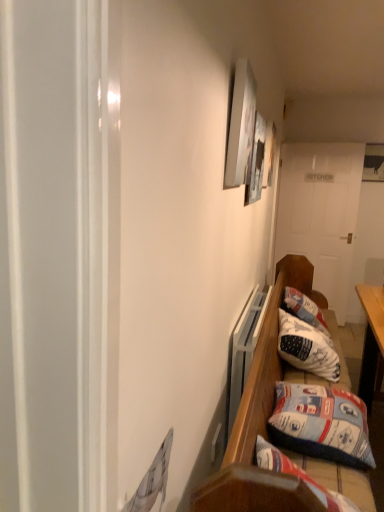
Find the location of a particular element. wooden bench at lower right is located at coordinates (265, 415).

Describe the element at coordinates (256, 162) in the screenshot. The height and width of the screenshot is (512, 384). I see `metallic silver picture frame at upper center, which is the second picture frame from front to back` at that location.

You are a GUI agent. You are given a task and a screenshot of the screen. Output one action in this format:
    pyautogui.click(x=<x>, y=<y>)
    Task: Click on the blue fabric pillow at lower right, positioned as the 2th pillow in back-to-front order
    
    Given the screenshot: What is the action you would take?
    pyautogui.click(x=321, y=424)

Considering the points (338, 484) and (309, 420), which point is behind, point (338, 484) or point (309, 420)?

The point (309, 420) is farther.

Which object is more forward, wooden bench at lower right or blue fabric pillow at lower right, which ranks as the first pillow in front-to-back order?

wooden bench at lower right is closer to the camera.

Can you confirm if wooden bench at lower right is wider than blue fabric pillow at lower right, positioned as the 2th pillow in back-to-front order?

Yes.

Considering the sizes of objects wooden bench at lower right and blue fabric pillow at lower right, which ranks as the first pillow in front-to-back order, in the image provided, who is taller, wooden bench at lower right or blue fabric pillow at lower right, which ranks as the first pillow in front-to-back order,?

wooden bench at lower right is taller.

Would you say blue fabric pillow at lower right, which ranks as the first pillow in front-to-back order, is to the left or to the right of matte white picture frame at upper center, placed as the 2th picture frame when sorted from right to left, in the picture?

Clearly, blue fabric pillow at lower right, which ranks as the first pillow in front-to-back order, is on the right of matte white picture frame at upper center, placed as the 2th picture frame when sorted from right to left, in the image.

How much distance is there between blue fabric pillow at lower right, which ranks as the first pillow in front-to-back order, and matte white picture frame at upper center, which is the first picture frame in front-to-back order?

blue fabric pillow at lower right, which ranks as the first pillow in front-to-back order, and matte white picture frame at upper center, which is the first picture frame in front-to-back order, are 1.06 meters apart.

From the image's perspective, which one is positioned higher, blue fabric pillow at lower right, positioned as the 2th pillow in back-to-front order, or matte white picture frame at upper center, which is counted as the second picture frame, starting from the back?

matte white picture frame at upper center, which is counted as the second picture frame, starting from the back, appears higher in the image.

Is blue fabric pillow at lower right, positioned as the 2th pillow in back-to-front order, not within matte white picture frame at upper center, which is the 1th picture frame in left-to-right order?

blue fabric pillow at lower right, positioned as the 2th pillow in back-to-front order, lies outside matte white picture frame at upper center, which is the 1th picture frame in left-to-right order,'s area.

Is metallic silver picture frame at upper center, which is the second picture frame from front to back, positioned beyond the bounds of white wooden door at center?

Yes.

From the picture: From the image's perspective, which one is positioned higher, metallic silver picture frame at upper center, arranged as the first picture frame when viewed from the back, or white wooden door at center?

metallic silver picture frame at upper center, arranged as the first picture frame when viewed from the back, from the image's perspective.

Which is less distant, (261, 123) or (334, 231)?

The point (261, 123) is closer.

Is metallic silver picture frame at upper center, the 2th picture frame when ordered from left to right, directly adjacent to white wooden door at center?

No, metallic silver picture frame at upper center, the 2th picture frame when ordered from left to right, is not touching white wooden door at center.

In the scene shown: Is there a large distance between matte white picture frame at upper center, which is the 1th picture frame in left-to-right order, and white wooden door at center?

Yes, matte white picture frame at upper center, which is the 1th picture frame in left-to-right order, and white wooden door at center are located far from each other.

How different are the orientations of matte white picture frame at upper center, which is the first picture frame in front-to-back order, and white wooden door at center in degrees?

matte white picture frame at upper center, which is the first picture frame in front-to-back order, and white wooden door at center are facing 102 degrees away from each other.

Is matte white picture frame at upper center, placed as the 2th picture frame when sorted from right to left, facing away from white wooden door at center?

No.

Considering the relative sizes of matte white picture frame at upper center, which is counted as the second picture frame, starting from the back, and white wooden door at center in the image provided, is matte white picture frame at upper center, which is counted as the second picture frame, starting from the back, wider than white wooden door at center?

In fact, matte white picture frame at upper center, which is counted as the second picture frame, starting from the back, might be narrower than white wooden door at center.

Which is nearer, (x=367, y=460) or (x=315, y=276)?

Point (x=367, y=460).

From a real-world perspective, which object rests below the other?

blue fabric pillow at lower right, which ranks as the first pillow in front-to-back order, is physically lower.

Locate an element on the screen. door that appears above the blue fabric pillow at lower right, which ranks as the first pillow in front-to-back order (from the image's perspective) is located at coordinates (321, 213).

Which of these two, white fabric pillow at lower right, positioned as the first pillow in back-to-front order, or white wooden door at center, is wider?

With larger width is white fabric pillow at lower right, positioned as the first pillow in back-to-front order.

Consider the image. From a real-world perspective, is white fabric pillow at lower right, positioned as the first pillow in back-to-front order, physically above white wooden door at center?

No, from a real-world perspective, white fabric pillow at lower right, positioned as the first pillow in back-to-front order, is not on top of white wooden door at center.

Based on their positions, is white fabric pillow at lower right, the 2th pillow in the front-to-back sequence, located to the left or right of white wooden door at center?

In the image, white fabric pillow at lower right, the 2th pillow in the front-to-back sequence, appears on the left side of white wooden door at center.

Would you say white fabric pillow at lower right, the 2th pillow in the front-to-back sequence, is outside white wooden door at center?

Yes, white fabric pillow at lower right, the 2th pillow in the front-to-back sequence, is not within white wooden door at center.

Does matte white picture frame at upper center, which is the first picture frame in front-to-back order, come in front of metallic silver picture frame at upper center, the first picture frame viewed from the right?

Yes, matte white picture frame at upper center, which is the first picture frame in front-to-back order, is closer to the camera.

Considering the relative sizes of matte white picture frame at upper center, which is the 1th picture frame in left-to-right order, and metallic silver picture frame at upper center, the 2th picture frame when ordered from left to right, in the image provided, is matte white picture frame at upper center, which is the 1th picture frame in left-to-right order, thinner than metallic silver picture frame at upper center, the 2th picture frame when ordered from left to right,?

No.

From the image's perspective, is matte white picture frame at upper center, which is counted as the second picture frame, starting from the back, under metallic silver picture frame at upper center, the 2th picture frame when ordered from left to right?

Yes.

Is matte white picture frame at upper center, which is the first picture frame in front-to-back order, inside or outside of metallic silver picture frame at upper center, the 2th picture frame when ordered from left to right?

matte white picture frame at upper center, which is the first picture frame in front-to-back order, is outside metallic silver picture frame at upper center, the 2th picture frame when ordered from left to right.

Where is `the 1st pillow positioned above the wooden bench at lower right (from the image's perspective)`? This screenshot has width=384, height=512. the 1st pillow positioned above the wooden bench at lower right (from the image's perspective) is located at coordinates (321, 424).

From the matte white picture frame at upper center, which is the 1th picture frame in left-to-right order, count 1st pillows backward and point to it. Please provide its 2D coordinates.

[(321, 424)]

Looking at the image, which one is located closer to metallic silver picture frame at upper center, which is the second picture frame from front to back, white wooden door at center or matte white picture frame at upper center, which is the 1th picture frame in left-to-right order?

matte white picture frame at upper center, which is the 1th picture frame in left-to-right order.

Which object lies nearer to the anchor point metallic silver picture frame at upper center, arranged as the first picture frame when viewed from the back, blue fabric pillow at lower right, positioned as the 2th pillow in back-to-front order, or wooden bench at lower right?

The object closer to metallic silver picture frame at upper center, arranged as the first picture frame when viewed from the back, is wooden bench at lower right.

From the image, which object appears to be nearer to wooden bench at lower right, metallic silver picture frame at upper center, which is the second picture frame from front to back, or white wooden door at center?

Among the two, metallic silver picture frame at upper center, which is the second picture frame from front to back, is located nearer to wooden bench at lower right.

From the image, which object appears to be nearer to blue fabric pillow at lower right, positioned as the 2th pillow in back-to-front order, matte white picture frame at upper center, which is counted as the second picture frame, starting from the back, or wooden bench at lower right?

wooden bench at lower right is positioned closer to the anchor blue fabric pillow at lower right, positioned as the 2th pillow in back-to-front order.

When comparing their distances from white wooden door at center, does wooden bench at lower right or blue fabric pillow at lower right, which ranks as the first pillow in front-to-back order, seem further?

The object further to white wooden door at center is blue fabric pillow at lower right, which ranks as the first pillow in front-to-back order.

Based on their spatial positions, is metallic silver picture frame at upper center, the first picture frame viewed from the right, or blue fabric pillow at lower right, which ranks as the first pillow in front-to-back order, closer to white wooden door at center?

metallic silver picture frame at upper center, the first picture frame viewed from the right, is positioned closer to the anchor white wooden door at center.

Estimate the real-world distances between objects in this image. Which object is further from blue fabric pillow at lower right, which ranks as the first pillow in front-to-back order, white fabric pillow at lower right, positioned as the first pillow in back-to-front order, or wooden bench at lower right?

white fabric pillow at lower right, positioned as the first pillow in back-to-front order, is positioned further to the anchor blue fabric pillow at lower right, which ranks as the first pillow in front-to-back order.

Considering their positions, is matte white picture frame at upper center, placed as the 2th picture frame when sorted from right to left, positioned closer to white wooden door at center than metallic silver picture frame at upper center, arranged as the first picture frame when viewed from the back?

metallic silver picture frame at upper center, arranged as the first picture frame when viewed from the back, is closer to white wooden door at center.

Where is `picture frame between matte white picture frame at upper center, which is counted as the second picture frame, starting from the back, and white wooden door at center, along the z-axis`? picture frame between matte white picture frame at upper center, which is counted as the second picture frame, starting from the back, and white wooden door at center, along the z-axis is located at coordinates click(256, 162).

Find the location of a particular element. This screenshot has height=512, width=384. pillow between metallic silver picture frame at upper center, the first picture frame viewed from the right, and white wooden door at center, along the z-axis is located at coordinates tap(307, 347).

You are a GUI agent. You are given a task and a screenshot of the screen. Output one action in this format:
    pyautogui.click(x=<x>, y=<y>)
    Task: Click on the pillow located between blue fabric pillow at lower right, which ranks as the first pillow in front-to-back order, and white wooden door at center in the depth direction
    
    Given the screenshot: What is the action you would take?
    pyautogui.click(x=307, y=347)

Locate an element on the screen. The height and width of the screenshot is (512, 384). picture frame between metallic silver picture frame at upper center, which is the second picture frame from front to back, and blue fabric pillow at lower right, positioned as the 2th pillow in back-to-front order, in the up-down direction is located at coordinates (240, 125).